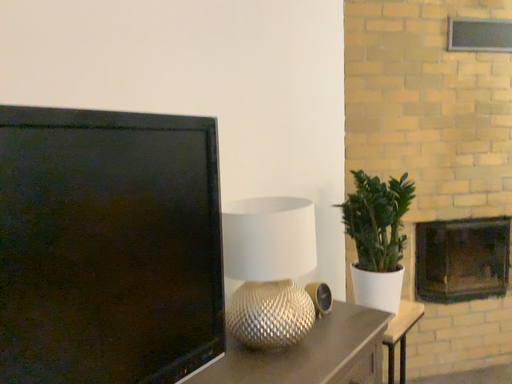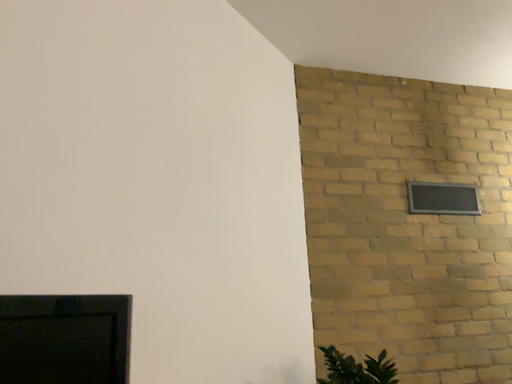
Question: How did the camera likely rotate when shooting the video?

Choices:
 (A) rotated downward
 (B) rotated upward

Answer: (B)